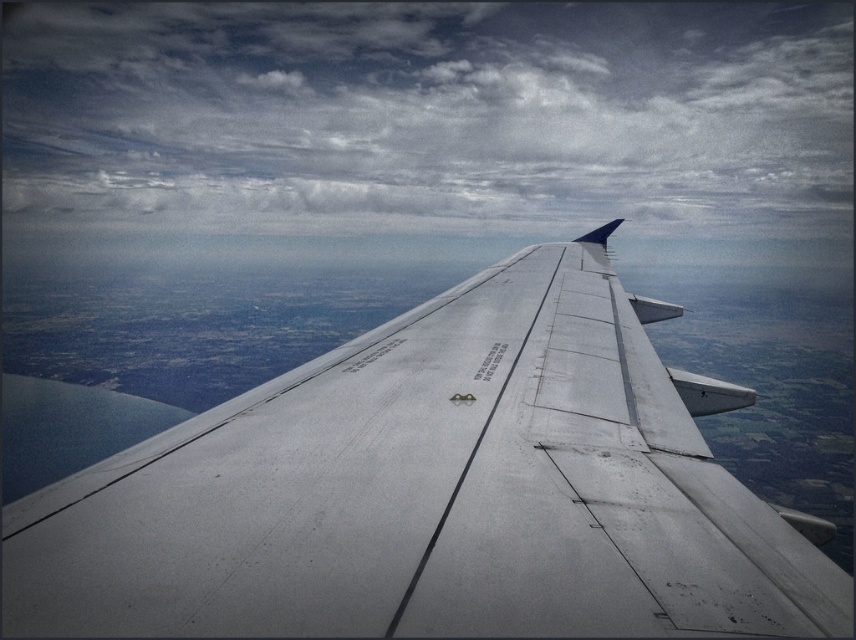
Question: Among these objects, which one is farthest from the camera?

Choices:
 (A) metallic gray wing at center
 (B) cloudy sky at upper center

Answer: (B)

Question: Does metallic gray wing at center appear under cloudy sky at upper center?

Choices:
 (A) no
 (B) yes

Answer: (B)

Question: Which object is farther from the camera taking this photo?

Choices:
 (A) metallic gray wing at center
 (B) cloudy sky at upper center

Answer: (B)

Question: Does metallic gray wing at center have a greater width compared to cloudy sky at upper center?

Choices:
 (A) yes
 (B) no

Answer: (B)

Question: Is metallic gray wing at center to the left of cloudy sky at upper center from the viewer's perspective?

Choices:
 (A) no
 (B) yes

Answer: (A)